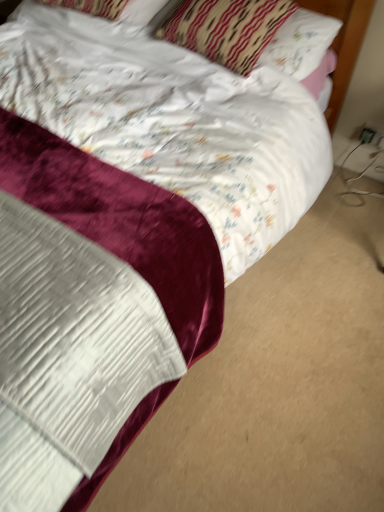
This screenshot has width=384, height=512. What do you see at coordinates (226, 29) in the screenshot?
I see `patterned fabric pillow at upper center, which is the first pillow in right-to-left order` at bounding box center [226, 29].

What do you see at coordinates (123, 12) in the screenshot?
I see `white satin pillow at upper center, which is counted as the 1th pillow, starting from the left` at bounding box center [123, 12].

Locate an element on the screen. This screenshot has width=384, height=512. black plastic outlet at lower right, which ranks as the 2th electric outlet in right-to-left order is located at coordinates (367, 135).

The height and width of the screenshot is (512, 384). I want to click on white plastic electric outlet at lower right, marked as the first electric outlet in a right-to-left arrangement, so click(370, 135).

Is patterned fabric pillow at upper center, which is the first pillow in right-to-left order, at the back of black plastic outlet at lower right, the 1th electric outlet positioned from the left?

That's not correct — black plastic outlet at lower right, the 1th electric outlet positioned from the left, is not looking away from patterned fabric pillow at upper center, which is the first pillow in right-to-left order.

How much distance is there between black plastic outlet at lower right, the 1th electric outlet positioned from the left, and patterned fabric pillow at upper center, which is the first pillow in right-to-left order?

32.97 inches.

From the picture: Is there a large distance between black plastic outlet at lower right, the 1th electric outlet positioned from the left, and patterned fabric pillow at upper center, which is the first pillow in right-to-left order?

No, black plastic outlet at lower right, the 1th electric outlet positioned from the left, is not far from patterned fabric pillow at upper center, which is the first pillow in right-to-left order.

Is black plastic outlet at lower right, which ranks as the 2th electric outlet in right-to-left order, inside or outside of patterned fabric pillow at upper center, which is the first pillow in right-to-left order?

black plastic outlet at lower right, which ranks as the 2th electric outlet in right-to-left order, is not inside patterned fabric pillow at upper center, which is the first pillow in right-to-left order, it's outside.

Is point (68, 2) more distant than point (368, 141)?

No.

How many degrees apart are the facing directions of white satin pillow at upper center, which is the 2th pillow from right to left, and black plastic outlet at lower right, which ranks as the 2th electric outlet in right-to-left order?

white satin pillow at upper center, which is the 2th pillow from right to left, and black plastic outlet at lower right, which ranks as the 2th electric outlet in right-to-left order, are facing 6.61 degrees away from each other.

Which of these two, white satin pillow at upper center, which is counted as the 1th pillow, starting from the left, or black plastic outlet at lower right, the 1th electric outlet positioned from the left, is bigger?

Bigger between the two is white satin pillow at upper center, which is counted as the 1th pillow, starting from the left.

How much distance is there between white satin pillow at upper center, which is counted as the 1th pillow, starting from the left, and black plastic outlet at lower right, which ranks as the 2th electric outlet in right-to-left order?

They are 1.15 meters apart.

In terms of width, does patterned fabric pillow at upper center, which is the first pillow in right-to-left order, look wider or thinner when compared to white plastic electric outlet at lower right, marked as the first electric outlet in a right-to-left arrangement?

Considering their sizes, patterned fabric pillow at upper center, which is the first pillow in right-to-left order, looks broader than white plastic electric outlet at lower right, marked as the first electric outlet in a right-to-left arrangement.

Consider the image. From the image's perspective, is patterned fabric pillow at upper center, which is the first pillow in right-to-left order, above white plastic electric outlet at lower right, which appears as the 2th electric outlet when viewed from the left?

Indeed, from the image's perspective, patterned fabric pillow at upper center, which is the first pillow in right-to-left order, is shown above white plastic electric outlet at lower right, which appears as the 2th electric outlet when viewed from the left.

How many degrees apart are the facing directions of patterned fabric pillow at upper center, which is the first pillow in right-to-left order, and white plastic electric outlet at lower right, which appears as the 2th electric outlet when viewed from the left?

The facing directions of patterned fabric pillow at upper center, which is the first pillow in right-to-left order, and white plastic electric outlet at lower right, which appears as the 2th electric outlet when viewed from the left, are 0.74 degrees apart.

Would you consider white plastic electric outlet at lower right, which appears as the 2th electric outlet when viewed from the left, to be distant from white satin pillow at upper center, which is the 2th pillow from right to left?

Absolutely, white plastic electric outlet at lower right, which appears as the 2th electric outlet when viewed from the left, is distant from white satin pillow at upper center, which is the 2th pillow from right to left.

Is the position of white plastic electric outlet at lower right, which appears as the 2th electric outlet when viewed from the left, more distant than that of white satin pillow at upper center, which is counted as the 1th pillow, starting from the left?

Yes, white plastic electric outlet at lower right, which appears as the 2th electric outlet when viewed from the left, is behind white satin pillow at upper center, which is counted as the 1th pillow, starting from the left.

From the image's perspective, which is below, white plastic electric outlet at lower right, marked as the first electric outlet in a right-to-left arrangement, or white satin pillow at upper center, which is counted as the 1th pillow, starting from the left?

white plastic electric outlet at lower right, marked as the first electric outlet in a right-to-left arrangement, from the image's perspective.

Which point is more distant from viewer, (379, 135) or (123, 9)?

The point (379, 135) is farther.

From the picture: Considering the sizes of black plastic outlet at lower right, the 1th electric outlet positioned from the left, and white satin pillow at upper center, which is counted as the 1th pillow, starting from the left, in the image, is black plastic outlet at lower right, the 1th electric outlet positioned from the left, wider or thinner than white satin pillow at upper center, which is counted as the 1th pillow, starting from the left,?

In the image, black plastic outlet at lower right, the 1th electric outlet positioned from the left, appears to be more narrow than white satin pillow at upper center, which is counted as the 1th pillow, starting from the left.

Does black plastic outlet at lower right, the 1th electric outlet positioned from the left, appear on the left side of white satin pillow at upper center, which is counted as the 1th pillow, starting from the left?

No, black plastic outlet at lower right, the 1th electric outlet positioned from the left, is not to the left of white satin pillow at upper center, which is counted as the 1th pillow, starting from the left.

Can you tell me how much black plastic outlet at lower right, which ranks as the 2th electric outlet in right-to-left order, and white satin pillow at upper center, which is counted as the 1th pillow, starting from the left, differ in facing direction?

Result: The angle between the facing direction of black plastic outlet at lower right, which ranks as the 2th electric outlet in right-to-left order, and the facing direction of white satin pillow at upper center, which is counted as the 1th pillow, starting from the left, is 6.61 degrees.

Is black plastic outlet at lower right, the 1th electric outlet positioned from the left, facing towards white satin pillow at upper center, which is counted as the 1th pillow, starting from the left?

No, black plastic outlet at lower right, the 1th electric outlet positioned from the left, is not turned towards white satin pillow at upper center, which is counted as the 1th pillow, starting from the left.

From a real-world perspective, which object rests below the other?

From a 3D spatial view, white plastic electric outlet at lower right, which appears as the 2th electric outlet when viewed from the left, is below.

Looking at this image, could white plastic electric outlet at lower right, marked as the first electric outlet in a right-to-left arrangement, be considered to be inside white satin pillow at upper center, which is counted as the 1th pillow, starting from the left?

No, white plastic electric outlet at lower right, marked as the first electric outlet in a right-to-left arrangement, is not a part of white satin pillow at upper center, which is counted as the 1th pillow, starting from the left.

Which of these two, white satin pillow at upper center, which is the 2th pillow from right to left, or white plastic electric outlet at lower right, marked as the first electric outlet in a right-to-left arrangement, is smaller?

Smaller between the two is white plastic electric outlet at lower right, marked as the first electric outlet in a right-to-left arrangement.

Can you confirm if white satin pillow at upper center, which is counted as the 1th pillow, starting from the left, is wider than white plastic electric outlet at lower right, marked as the first electric outlet in a right-to-left arrangement?

Yes, white satin pillow at upper center, which is counted as the 1th pillow, starting from the left, is wider than white plastic electric outlet at lower right, marked as the first electric outlet in a right-to-left arrangement.

Is white plastic electric outlet at lower right, which appears as the 2th electric outlet when viewed from the left, surrounded by black plastic outlet at lower right, which ranks as the 2th electric outlet in right-to-left order?

No, black plastic outlet at lower right, which ranks as the 2th electric outlet in right-to-left order, does not contain white plastic electric outlet at lower right, which appears as the 2th electric outlet when viewed from the left.

Are black plastic outlet at lower right, the 1th electric outlet positioned from the left, and white plastic electric outlet at lower right, marked as the first electric outlet in a right-to-left arrangement, making contact?

Yes, black plastic outlet at lower right, the 1th electric outlet positioned from the left, is touching white plastic electric outlet at lower right, marked as the first electric outlet in a right-to-left arrangement.

Looking at this image, from a real-world perspective, is black plastic outlet at lower right, the 1th electric outlet positioned from the left, physically above white plastic electric outlet at lower right, which appears as the 2th electric outlet when viewed from the left?

Yes, from a real-world perspective, black plastic outlet at lower right, the 1th electric outlet positioned from the left, is over white plastic electric outlet at lower right, which appears as the 2th electric outlet when viewed from the left

From a real-world perspective, count 2nd pillows upward from the black plastic outlet at lower right, which ranks as the 2th electric outlet in right-to-left order, and point to it. Please provide its 2D coordinates.

[(226, 29)]

At what (x,y) coordinates should I click in order to perform the action: click on the 2nd pillow counting from the left side of the black plastic outlet at lower right, which ranks as the 2th electric outlet in right-to-left order. Please return your answer as a coordinate pair (x, y). This screenshot has width=384, height=512. Looking at the image, I should click on (123, 12).

When comparing their distances from white satin pillow at upper center, which is counted as the 1th pillow, starting from the left, does patterned fabric pillow at upper center, which is the first pillow in right-to-left order, or white plastic electric outlet at lower right, which appears as the 2th electric outlet when viewed from the left, seem further?

white plastic electric outlet at lower right, which appears as the 2th electric outlet when viewed from the left, is further to white satin pillow at upper center, which is counted as the 1th pillow, starting from the left.

When comparing their distances from patterned fabric pillow at upper center, which is the first pillow in right-to-left order, does white plastic electric outlet at lower right, which appears as the 2th electric outlet when viewed from the left, or black plastic outlet at lower right, which ranks as the 2th electric outlet in right-to-left order, seem further?

black plastic outlet at lower right, which ranks as the 2th electric outlet in right-to-left order.

Estimate the real-world distances between objects in this image. Which object is further from patterned fabric pillow at upper center, which is the first pillow in right-to-left order, black plastic outlet at lower right, which ranks as the 2th electric outlet in right-to-left order, or white plastic electric outlet at lower right, marked as the first electric outlet in a right-to-left arrangement?

black plastic outlet at lower right, which ranks as the 2th electric outlet in right-to-left order.

Looking at the image, which one is located closer to patterned fabric pillow at upper center, which is the first pillow in right-to-left order, white satin pillow at upper center, which is counted as the 1th pillow, starting from the left, or black plastic outlet at lower right, the 1th electric outlet positioned from the left?

white satin pillow at upper center, which is counted as the 1th pillow, starting from the left.

Consider the image. From the image, which object appears to be nearer to black plastic outlet at lower right, the 1th electric outlet positioned from the left, patterned fabric pillow at upper center, which is the first pillow in right-to-left order, or white plastic electric outlet at lower right, marked as the first electric outlet in a right-to-left arrangement?

white plastic electric outlet at lower right, marked as the first electric outlet in a right-to-left arrangement, is closer to black plastic outlet at lower right, the 1th electric outlet positioned from the left.

Considering their positions, is white satin pillow at upper center, which is the 2th pillow from right to left, positioned further to black plastic outlet at lower right, which ranks as the 2th electric outlet in right-to-left order, than white plastic electric outlet at lower right, which appears as the 2th electric outlet when viewed from the left?

white satin pillow at upper center, which is the 2th pillow from right to left, is further to black plastic outlet at lower right, which ranks as the 2th electric outlet in right-to-left order.

Estimate the real-world distances between objects in this image. Which object is further from black plastic outlet at lower right, the 1th electric outlet positioned from the left, white plastic electric outlet at lower right, which appears as the 2th electric outlet when viewed from the left, or patterned fabric pillow at upper center, which appears as the 2th pillow when viewed from the left?

Based on the image, patterned fabric pillow at upper center, which appears as the 2th pillow when viewed from the left, appears to be further to black plastic outlet at lower right, the 1th electric outlet positioned from the left.

Estimate the real-world distances between objects in this image. Which object is further from black plastic outlet at lower right, the 1th electric outlet positioned from the left, white plastic electric outlet at lower right, marked as the first electric outlet in a right-to-left arrangement, or white satin pillow at upper center, which is counted as the 1th pillow, starting from the left?

white satin pillow at upper center, which is counted as the 1th pillow, starting from the left, lies further to black plastic outlet at lower right, the 1th electric outlet positioned from the left, than the other object.

The image size is (384, 512). I want to click on electric outlet between patterned fabric pillow at upper center, which is the first pillow in right-to-left order, and white plastic electric outlet at lower right, which appears as the 2th electric outlet when viewed from the left, so click(367, 135).

Find the location of a particular element. pillow located between white satin pillow at upper center, which is the 2th pillow from right to left, and white plastic electric outlet at lower right, which appears as the 2th electric outlet when viewed from the left, in the left-right direction is located at coordinates (226, 29).

Identify the location of electric outlet between white satin pillow at upper center, which is counted as the 1th pillow, starting from the left, and white plastic electric outlet at lower right, which appears as the 2th electric outlet when viewed from the left, from left to right. (367, 135).

Find the location of `pillow located between white satin pillow at upper center, which is counted as the 1th pillow, starting from the left, and black plastic outlet at lower right, which ranks as the 2th electric outlet in right-to-left order, in the left-right direction`. pillow located between white satin pillow at upper center, which is counted as the 1th pillow, starting from the left, and black plastic outlet at lower right, which ranks as the 2th electric outlet in right-to-left order, in the left-right direction is located at coordinates (226, 29).